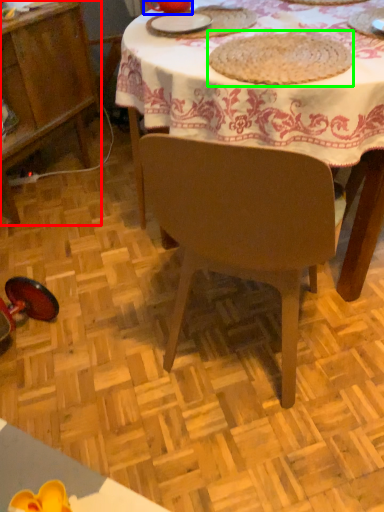
Question: Based on their relative distances, which object is nearer to cabinetry (highlighted by a red box)? Choose from tableware (highlighted by a blue box) and food (highlighted by a green box).

Choices:
 (A) tableware
 (B) food

Answer: (A)